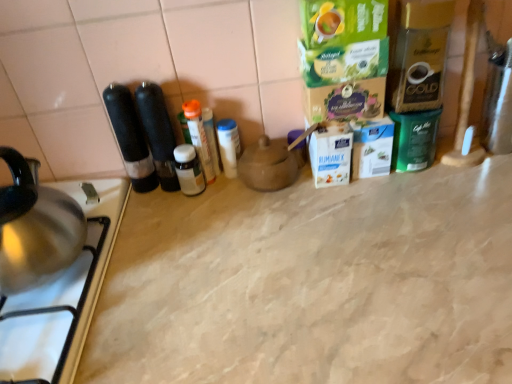
The height and width of the screenshot is (384, 512). I want to click on vacant space situated on the left part of white glossy bottle at center, which is the third bottle from right to left, so click(145, 213).